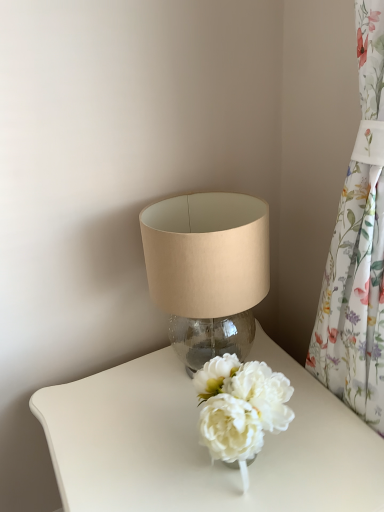
The image size is (384, 512). Identify the location of free point below translucent glass lampshade at upper center (from a real-world perspective). pyautogui.click(x=215, y=352).